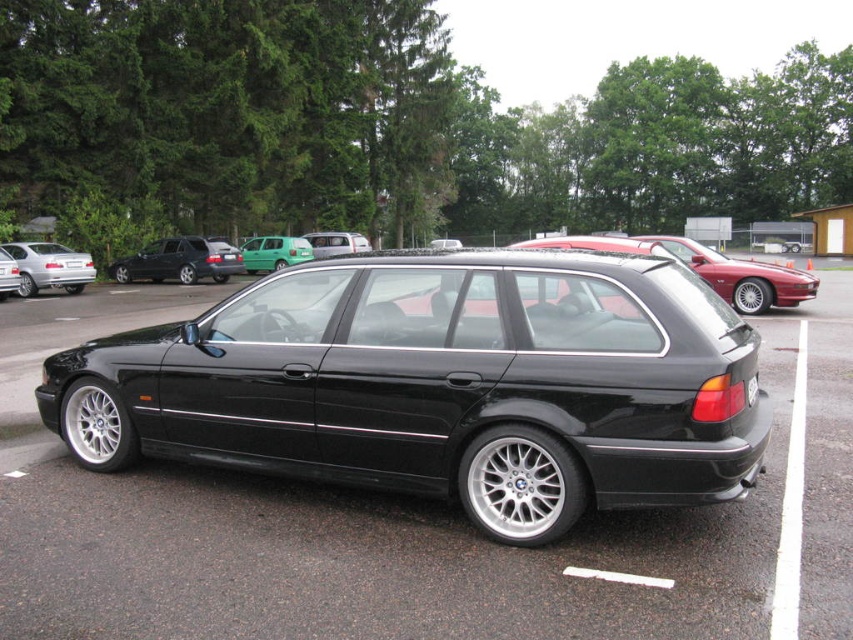
You are a parking attendant and need to move the silver metallic sedan at left and the metallic silver van at center. Based on their positions, which vehicle should you move first to allow the other to exit without obstruction?

The silver metallic sedan at left is in front of the metallic silver van at center, so you should move the silver metallic sedan at left first to allow the metallic silver van at center to exit without obstruction.

You are a parking attendant who needs to guide a driver to their car. You see the satin black wagon at center and the silver metallic sedan at left. Which car is positioned higher relative to the other?

The satin black wagon at center is positioned higher than the silver metallic sedan at left according to the description.